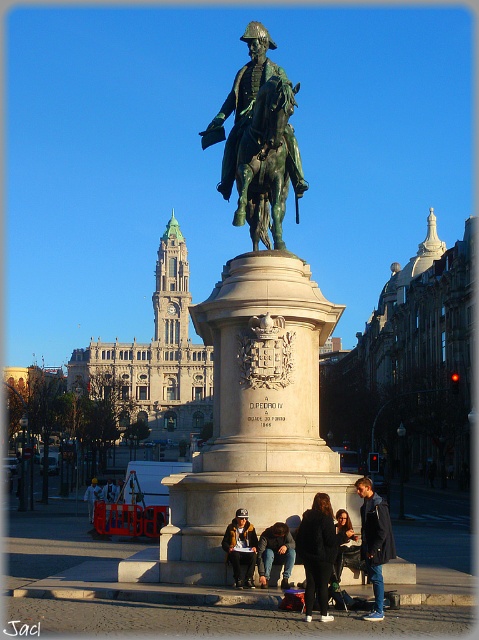
Who is taller, green bronze statue at center or dark blue jeans at center?

green bronze statue at center

Can you confirm if green bronze statue at center is taller than dark blue jeans at center?

Indeed, green bronze statue at center has a greater height compared to dark blue jeans at center.

Image resolution: width=479 pixels, height=640 pixels. What do you see at coordinates (257, 122) in the screenshot?
I see `green bronze statue at center` at bounding box center [257, 122].

I want to click on green bronze statue at center, so click(257, 122).

Does green patina horse at center have a greater width compared to dark blue jeans at lower center?

Indeed, green patina horse at center has a greater width compared to dark blue jeans at lower center.

Describe the element at coordinates (266, 163) in the screenshot. I see `green patina horse at center` at that location.

Where is `green patina horse at center`? green patina horse at center is located at coordinates (266, 163).

Is matte black jacket at lower center wider than light blue denim jacket at lower center?

Incorrect, matte black jacket at lower center's width does not surpass light blue denim jacket at lower center's.

Identify the location of matte black jacket at lower center. (342, 541).